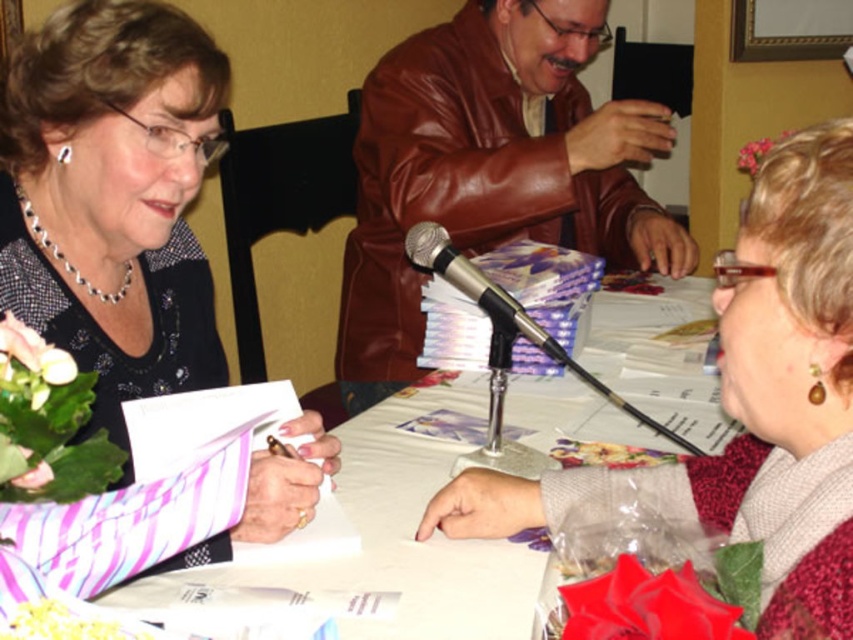
Question: Which point is farther from the camera taking this photo?

Choices:
 (A) (503, 324)
 (B) (577, 476)
 (C) (35, 307)
 (D) (91, 552)

Answer: (A)

Question: Does matte black card at center appear on the right side of matte brown jacket at center?

Choices:
 (A) yes
 (B) no

Answer: (B)

Question: Can you confirm if brown leather jacket at center is wider than white paper at center?

Choices:
 (A) no
 (B) yes

Answer: (B)

Question: Where is matte black card at center located in relation to brown leather jacket at center in the image?

Choices:
 (A) right
 (B) left

Answer: (B)

Question: Based on their relative distances, which object is farther from the matte black card at center?

Choices:
 (A) brown leather jacket at center
 (B) white paper at center
 (C) metallic silver microphone at center
 (D) matte brown jacket at center

Answer: (A)

Question: Which point is closer to the camera?

Choices:
 (A) (78, 221)
 (B) (564, 364)
 (C) (303, 536)

Answer: (C)